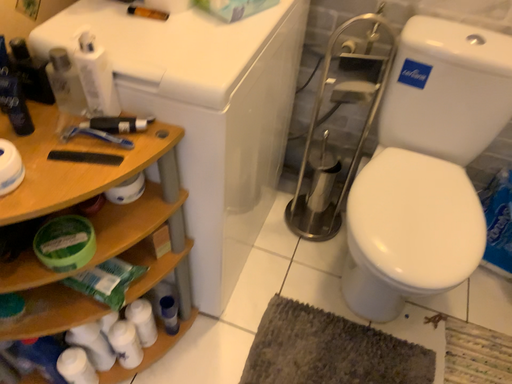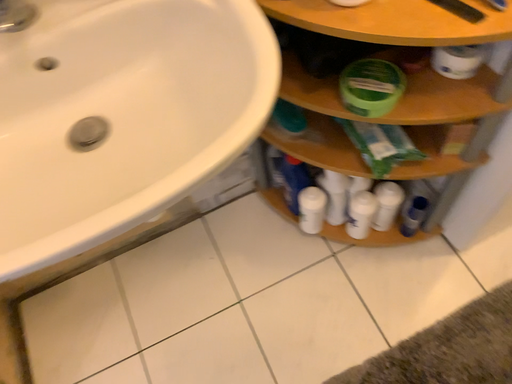
Question: Which way did the camera rotate in the video?

Choices:
 (A) rotated left
 (B) rotated right

Answer: (A)